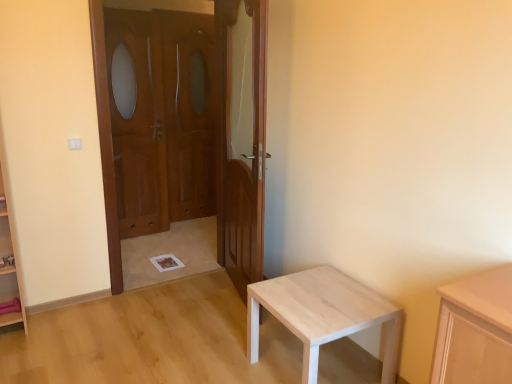
You are a GUI agent. You are given a task and a screenshot of the screen. Output one action in this format:
    pyautogui.click(x=<x>, y=<y>)
    Task: Click on the vacant space situated on the left part of wooden at center, placed as the 2th door when sorted from left to right
    This screenshot has width=512, height=384.
    Given the screenshot: What is the action you would take?
    pyautogui.click(x=186, y=299)